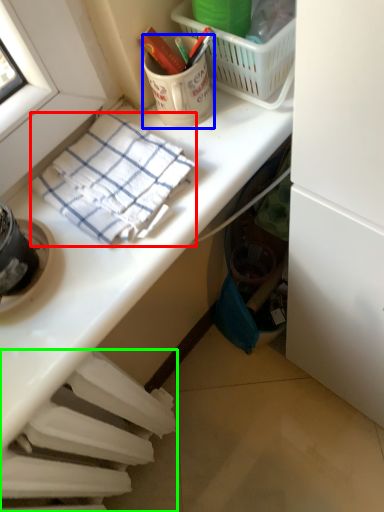
Question: Which object is the closest to the towel/napkin (highlighted by a red box)? Choose among these: coffee cup (highlighted by a blue box) or radiator (highlighted by a green box).

Choices:
 (A) coffee cup
 (B) radiator

Answer: (A)